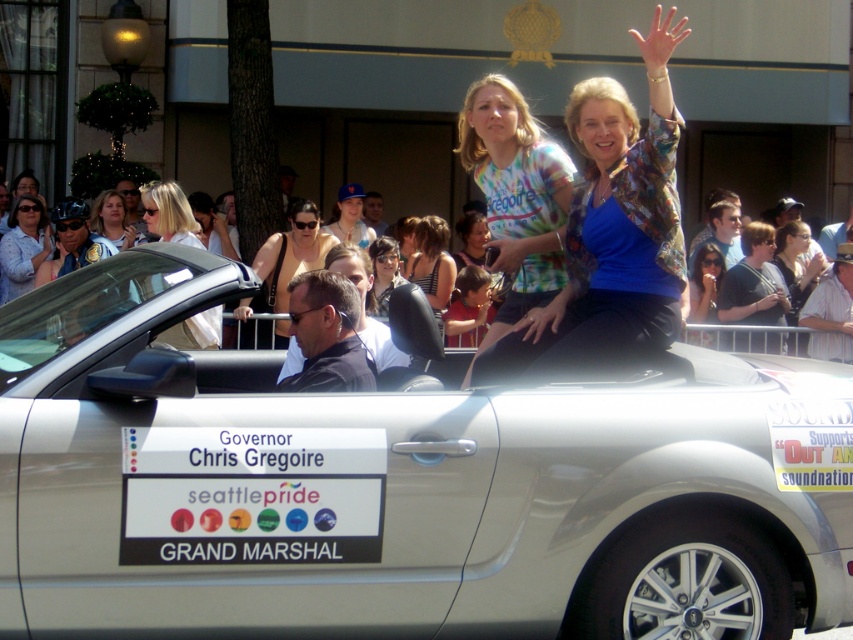
Does matte black convertible at center appear on the left side of white matte sunglasses at upper left?

No, matte black convertible at center is not to the left of white matte sunglasses at upper left.

Is matte black convertible at center in front of white matte sunglasses at upper left?

That is False.

Is point (769, 324) positioned after point (207, 340)?

Yes.

What are the coordinates of `matte black convertible at center` in the screenshot? It's located at (776, 339).

What do you see at coordinates (283, 262) in the screenshot?
I see `matte yellow tank top at center` at bounding box center [283, 262].

Does matte yellow tank top at center have a greater width compared to matte black jacket at center?

Yes.

You are a GUI agent. You are given a task and a screenshot of the screen. Output one action in this format:
    pyautogui.click(x=<x>, y=<y>)
    Task: Click on the matte yellow tank top at center
    The width and height of the screenshot is (853, 640).
    Given the screenshot: What is the action you would take?
    pyautogui.click(x=283, y=262)

Identify the location of matte yellow tank top at center. (283, 262).

Between matte black jacket at center and matte white shirt at upper center, which one is positioned higher?

matte white shirt at upper center

Does matte black jacket at center come in front of matte white shirt at upper center?

Yes, it is in front of matte white shirt at upper center.

Between point (396, 244) and point (99, 209), which one is positioned behind?

Point (99, 209)

The image size is (853, 640). Identify the location of matte black jacket at center. (383, 273).